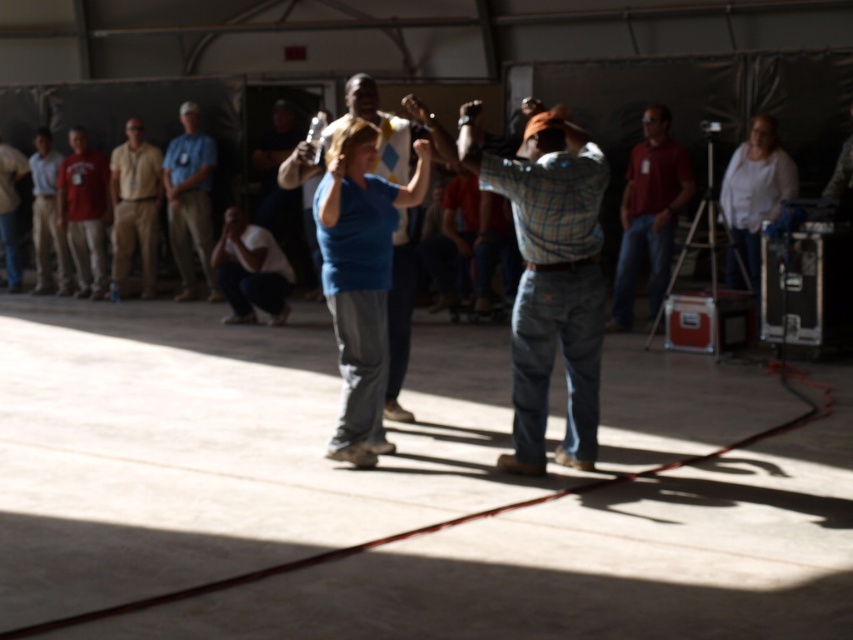
You are standing in the middle of the room and see two points marked on the floor. The first point is at coordinates point (231, 209) and the second is at point (9, 172). Which point is closer to you?

Point (231, 209) is closer to the camera than point (9, 172), so the first point is closer to you.

You are a referee in a game where players must stay above the red line on the floor. You see the white cotton shirt at right and the light brown uniform at center. Which player is violating the rule?

The white cotton shirt at right is violating the rule because it is positioned under the light brown uniform at center, meaning it is closer to the floor and likely below the red line.